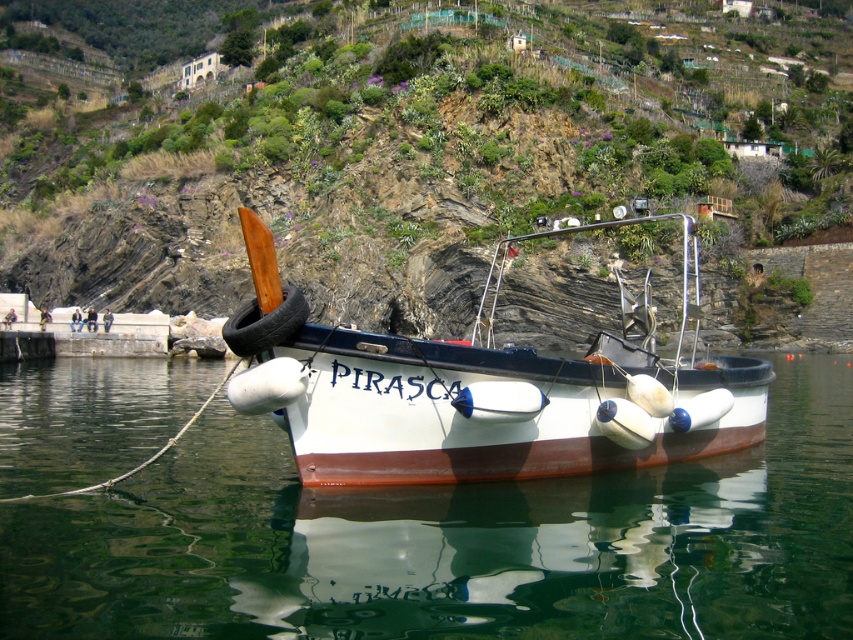
You are a drone operator trying to capture a photo of the boat PIRASCA. You need to position your drone so that it can hover above the green grassy hillside at upper center. What are the coordinates where you should direct the drone to hover?

The coordinates for the green grassy hillside at upper center are at point (x=421, y=148). Direct the drone to hover there.

You are a photographer planning to take a landscape photo of the green grassy hillside at upper center and the transparent water at center. Which object will appear larger in the photo?

The green grassy hillside at upper center will appear larger in the photo because it is taller than the transparent water at center.

You are standing on the rocky shoreline and want to determine which of the two points, point (294, 13) or point (318, 385), is closer to you. Based on the boat and its surroundings, which point is nearer?

Point (294, 13) is closer to you because it is further to the viewer than point (318, 385).